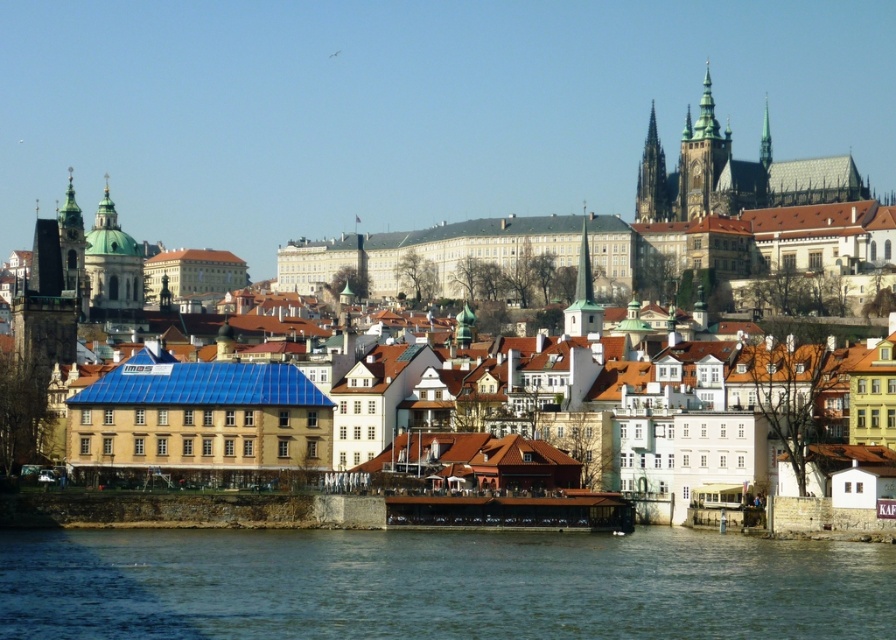
Question: Is greenish-blue water at lower center further to the viewer compared to smooth stone spire at upper right?

Choices:
 (A) no
 (B) yes

Answer: (A)

Question: Which point is farther to the camera?

Choices:
 (A) green domed tower at upper left
 (B) green stone tower at upper center
 (C) blue tiled roof at center

Answer: (B)

Question: Which of the following is the closest to the observer?

Choices:
 (A) green stone tower at upper center
 (B) smooth stone spire at upper right

Answer: (A)

Question: Does blue tiled roof at center have a larger size compared to smooth stone spire at upper right?

Choices:
 (A) yes
 (B) no

Answer: (A)

Question: Can you confirm if smooth stone spire at upper right is smaller than green stone spire at upper right?

Choices:
 (A) yes
 (B) no

Answer: (A)

Question: Which object is positioned closest to the green stone spire at upper right?

Choices:
 (A) smooth stone spire at upper right
 (B) blue tiled roof at center
 (C) greenish-blue water at lower center

Answer: (A)